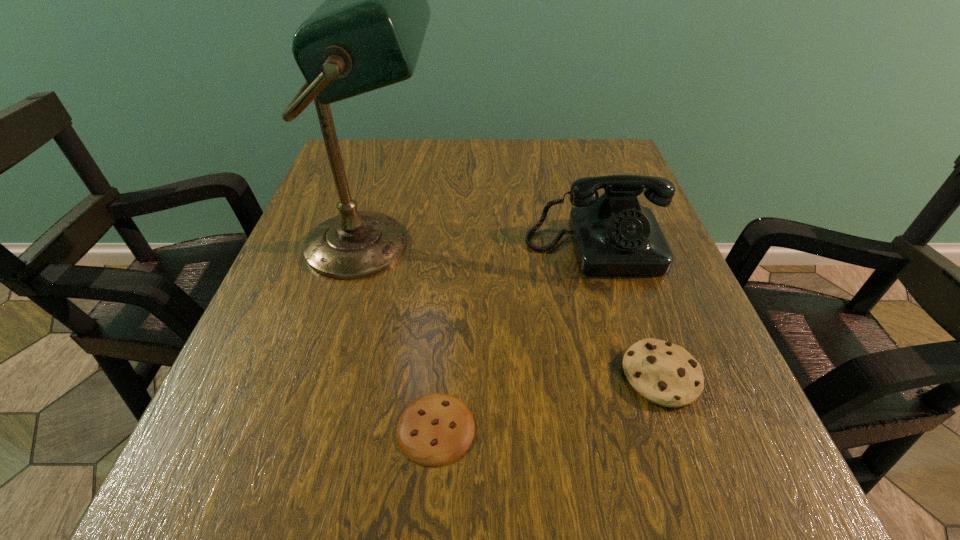
The image size is (960, 540). I want to click on table lamp, so click(x=368, y=33).

Identify the location of the third shortest object. The width and height of the screenshot is (960, 540). (613, 234).

The image size is (960, 540). Find the location of `the right cookie`. the right cookie is located at coordinates (664, 373).

Find the location of a particular element. the taller cookie is located at coordinates point(664,373).

Image resolution: width=960 pixels, height=540 pixels. In order to click on the shortest object in this screenshot , I will do `click(437, 429)`.

Identify the location of the left cookie. The image size is (960, 540). (437, 429).

In order to click on vacant space located 0.140m above the green lampshade of the tallest object in this screenshot , I will do `click(512, 245)`.

Image resolution: width=960 pixels, height=540 pixels. Identify the location of vacant space positioned 0.110m on the dial of the telephone. (618, 324).

The width and height of the screenshot is (960, 540). I want to click on vacant region located 0.090m on the front of the third tallest object, so click(x=695, y=477).

The image size is (960, 540). I want to click on vacant position located on the left of the left cookie, so click(x=225, y=428).